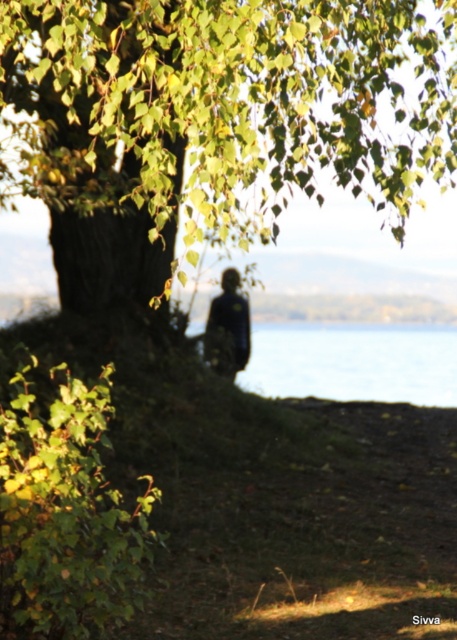
You are planning to set up a tent in this area. The tent requires a flat space that is taller than the green leafy tree at upper left. Is the transparent water at center suitable for setting up the tent?

The transparent water at center is taller than the green leafy tree at upper left. Therefore, the transparent water at center is suitable for setting up the tent since it meets the height requirement.

Based on the scene description, where is the green leafy tree at upper left located in terms of its 2D coordinates?

The green leafy tree at upper left is located at the 2D coordinates of point (213, 120).

From the picture: You are standing at the point marked by the coordinates point (354, 362) in the image. What is located at this point?

The point (354, 362) marks transparent water at center.